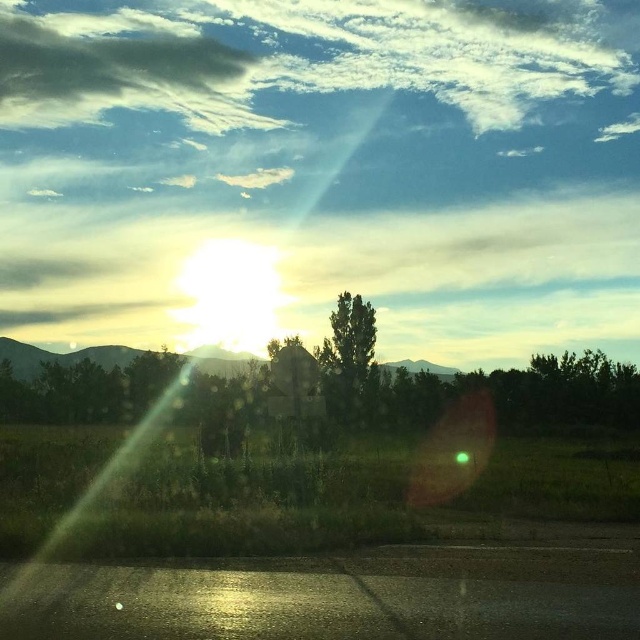
You are standing on the road in the image and see a point at coordinates (518, 392). Which object is this point located on?

The point at coordinates (518, 392) is located on the green leafy tree at center.

You are standing on the road in the foreground and want to walk towards the trees in the center. Which tree will you reach first, the green leafy tree at center or the green matte tree at center?

The green leafy tree at center is closer to the viewer than the green matte tree at center, so you will reach the green leafy tree at center first.